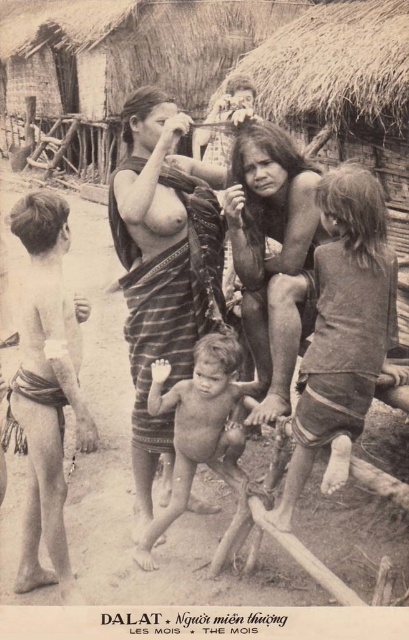
You are a photographer analyzing this black and white photo. You notice a person with light brown skin at left. Where exactly is this person located in the image?

The light brown skin at left is located at point (45, 387) in the image.

You are a photographer in a rural village and need to determine the relative lengths of two items in the scene to ensure proper framing. Which object is shorter between the dark brown fabric shorts at center and the light brown skin at left?

The dark brown fabric shorts at center is shorter than the light brown skin at left according to the description.

You are a photographer in the scene and want to place your camera closer to the dark brown fabric shorts at center. How much distance do you need to move the camera to achieve this?

The camera and dark brown fabric shorts at center are 8.80 feet apart. To place the camera closer, you would need to move it 8.80 feet towards the shorts.